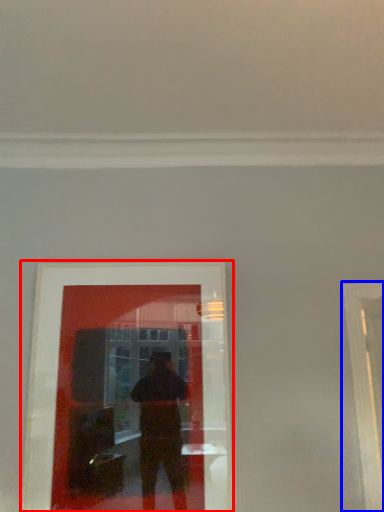
Question: Which of the following is the closest to the observer, picture frame (highlighted by a red box) or window frame (highlighted by a blue box)?

Choices:
 (A) picture frame
 (B) window frame

Answer: (B)